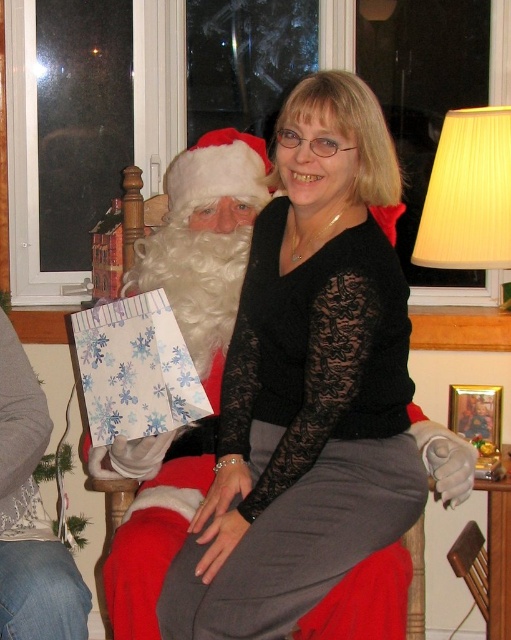
Question: Is black lace sweater at center further to the viewer compared to white fluffy beard at left?

Choices:
 (A) no
 (B) yes

Answer: (A)

Question: Which point appears closest to the camera in this image?

Choices:
 (A) (174, 442)
 (B) (303, 500)

Answer: (B)

Question: From the image, what is the correct spatial relationship of black lace sweater at center in relation to white fluffy beard at left?

Choices:
 (A) right
 (B) left

Answer: (A)

Question: Does black lace sweater at center appear on the right side of white fluffy beard at left?

Choices:
 (A) no
 (B) yes

Answer: (B)

Question: Which point is farther from the camera taking this photo?

Choices:
 (A) pyautogui.click(x=326, y=241)
 (B) pyautogui.click(x=167, y=561)

Answer: (B)